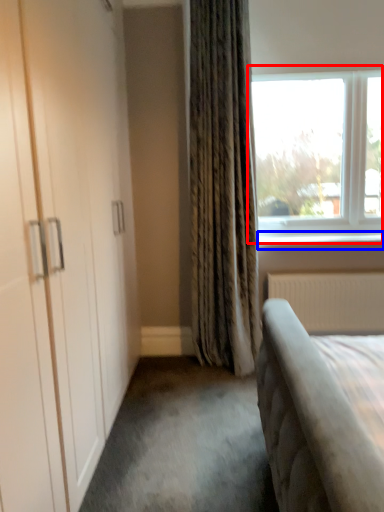
Question: Which object is closer to the camera taking this photo, window (highlighted by a red box) or window sill (highlighted by a blue box)?

Choices:
 (A) window
 (B) window sill

Answer: (A)